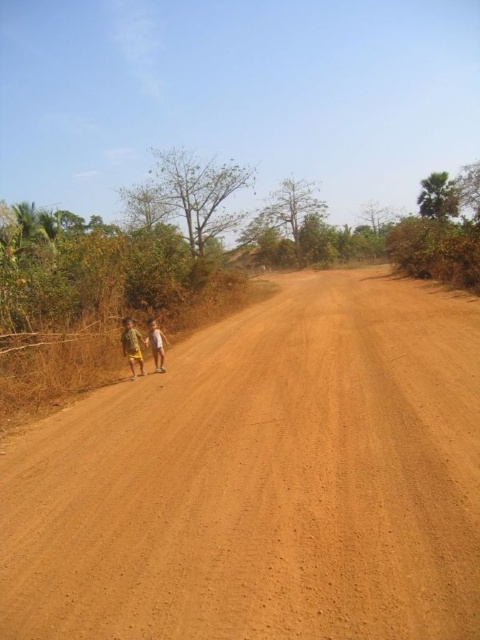
Question: Which point appears farthest from the camera in this image?

Choices:
 (A) (216, 516)
 (B) (127, 324)
 (C) (166, 339)
 (D) (123, 355)

Answer: (D)

Question: Is yellow fabric shorts at left smaller than light brown skin at left?

Choices:
 (A) yes
 (B) no

Answer: (B)

Question: Is the position of brown sandy dirt track at center more distant than that of yellow fabric shorts at left?

Choices:
 (A) yes
 (B) no

Answer: (B)

Question: Can you confirm if camouflage fabric shirt at left is smaller than light brown skin at left?

Choices:
 (A) yes
 (B) no

Answer: (B)

Question: Which object is the farthest from the light brown skin at left?

Choices:
 (A) camouflage fabric shirt at left
 (B) brown sandy dirt track at center

Answer: (B)

Question: Among these objects, which one is farthest from the camera?

Choices:
 (A) yellow fabric shorts at left
 (B) light brown skin at left
 (C) brown sandy dirt track at center
 (D) camouflage fabric shirt at left

Answer: (B)